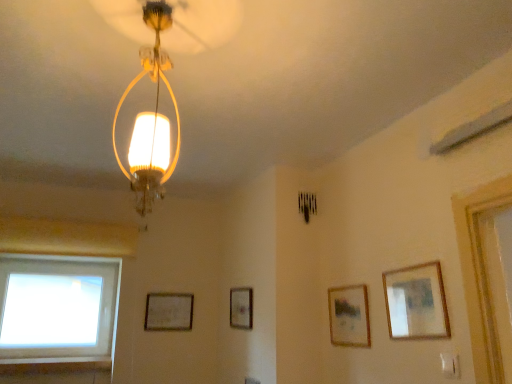
Question: From the image's perspective, is matte glass lampshade at upper center located above transparent glass window at lower left?

Choices:
 (A) yes
 (B) no

Answer: (A)

Question: Is matte glass lampshade at upper center closer to the viewer compared to transparent glass window at lower left?

Choices:
 (A) no
 (B) yes

Answer: (B)

Question: Is transparent glass window at lower left located within matte glass lampshade at upper center?

Choices:
 (A) yes
 (B) no

Answer: (B)

Question: Are matte glass lampshade at upper center and transparent glass window at lower left far apart?

Choices:
 (A) yes
 (B) no

Answer: (A)

Question: Is matte glass lampshade at upper center taller than transparent glass window at lower left?

Choices:
 (A) yes
 (B) no

Answer: (A)

Question: Is transparent glass window at lower left situated inside wooden framed picture at center right, which ranks as the second picture frame in right-to-left order, or outside?

Choices:
 (A) outside
 (B) inside

Answer: (A)

Question: Considering their positions, is transparent glass window at lower left located in front of or behind wooden framed picture at center right, arranged as the 3th picture frame when viewed from the left?

Choices:
 (A) behind
 (B) front

Answer: (A)

Question: In terms of width, does transparent glass window at lower left look wider or thinner when compared to wooden framed picture at center right, which ranks as the second picture frame in right-to-left order?

Choices:
 (A) thin
 (B) wide

Answer: (B)

Question: In terms of height, does transparent glass window at lower left look taller or shorter compared to wooden framed picture at center right, which is counted as the 3th picture frame, starting from the back?

Choices:
 (A) short
 (B) tall

Answer: (B)

Question: Relative to wooden picture frame at upper right, which is counted as the 4th picture frame, starting from the back, is wooden framed picture at center, which appears as the third picture frame when viewed from the front, in front or behind?

Choices:
 (A) front
 (B) behind

Answer: (B)

Question: Is wooden framed picture at center, placed as the 2th picture frame when sorted from left to right, taller or shorter than wooden picture frame at upper right, which is counted as the 4th picture frame, starting from the back?

Choices:
 (A) tall
 (B) short

Answer: (B)

Question: Considering the relative positions of wooden framed picture at center, which is the third picture frame from right to left, and wooden picture frame at upper right, the fourth picture frame in the left-to-right sequence, in the image provided, is wooden framed picture at center, which is the third picture frame from right to left, to the left or to the right of wooden picture frame at upper right, the fourth picture frame in the left-to-right sequence,?

Choices:
 (A) right
 (B) left

Answer: (B)

Question: Is wooden framed picture at center, acting as the second picture frame starting from the back, bigger or smaller than wooden picture frame at upper right, the fourth picture frame in the left-to-right sequence?

Choices:
 (A) big
 (B) small

Answer: (A)

Question: Which is correct: matte silver picture frame at lower left, the 1th picture frame when ordered from left to right, is inside transparent glass window at lower left, or outside of it?

Choices:
 (A) inside
 (B) outside

Answer: (B)

Question: From the image's perspective, is matte silver picture frame at lower left, the 4th picture frame when ordered from front to back, above or below transparent glass window at lower left?

Choices:
 (A) above
 (B) below

Answer: (B)